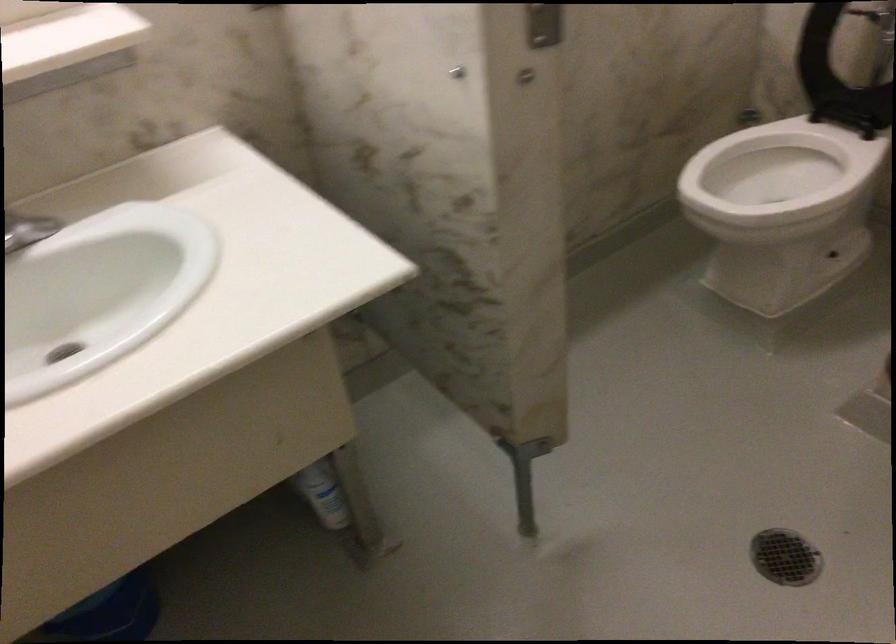
In order to click on white plastic bottle in this screenshot , I will do `click(323, 494)`.